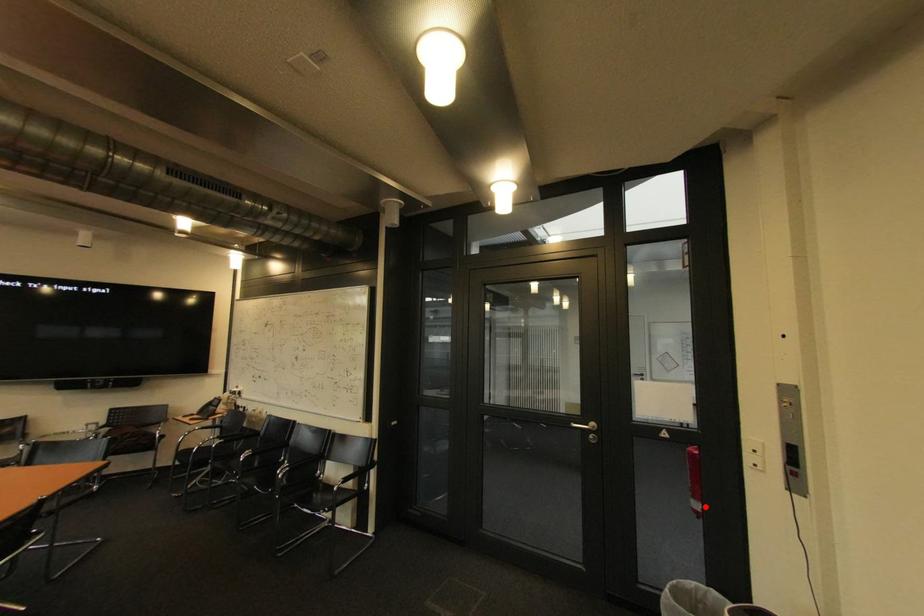
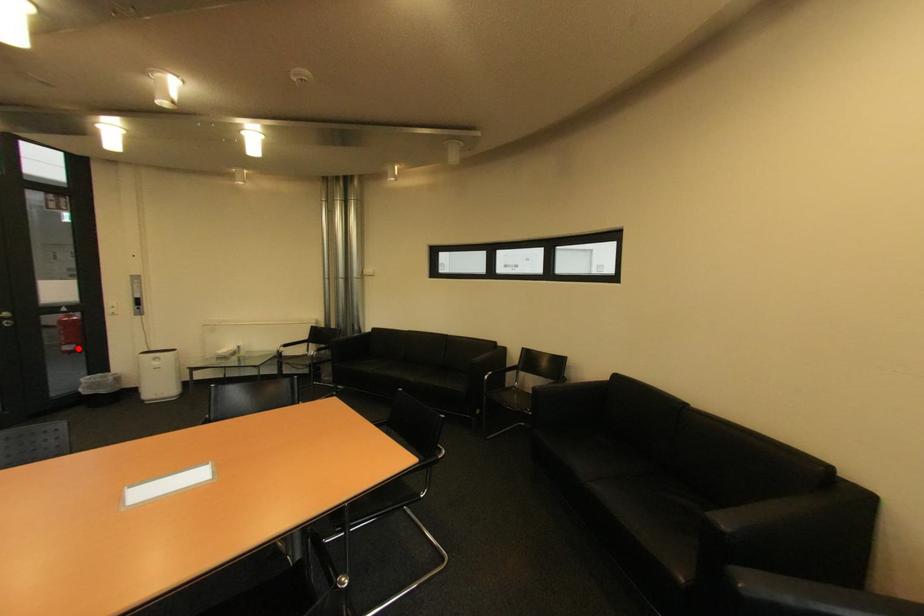
I am providing you with two images of the same scene from different viewpoints. A red point is marked on the first image and another point is marked on the second image. Does the point marked in image1 correspond to the same location as the one in image2?

Yes